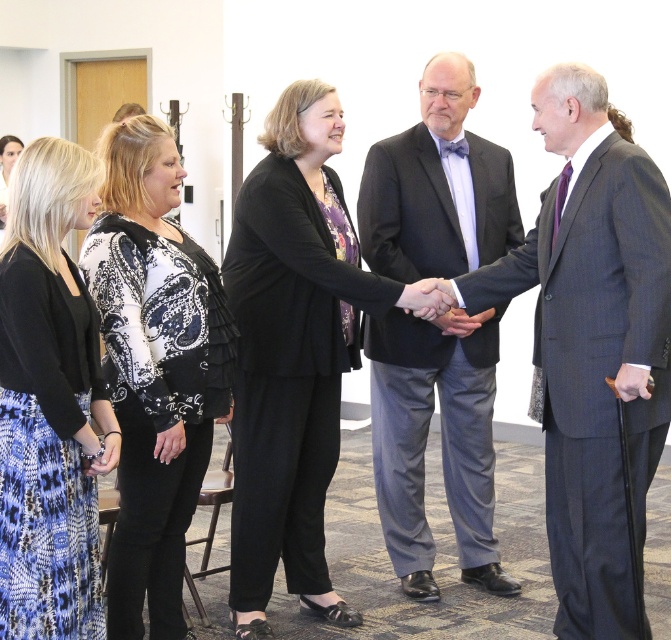
You are standing at the entrance of the room and want to greet both the person wearing the dark gray suit at center and the person wearing the black paisley blouse at center. Which one is closer to you?

Both the dark gray suit at center and the black paisley blouse at center are at the same central position, so they are equally close to you.